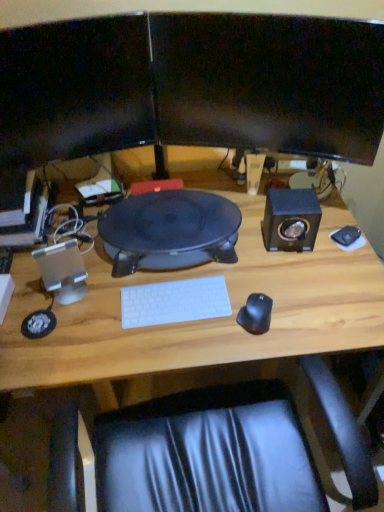
The image size is (384, 512). I want to click on vacant space situated on the left part of black matte mouse at right, placed as the 2th mouse when sorted from left to right, so click(294, 247).